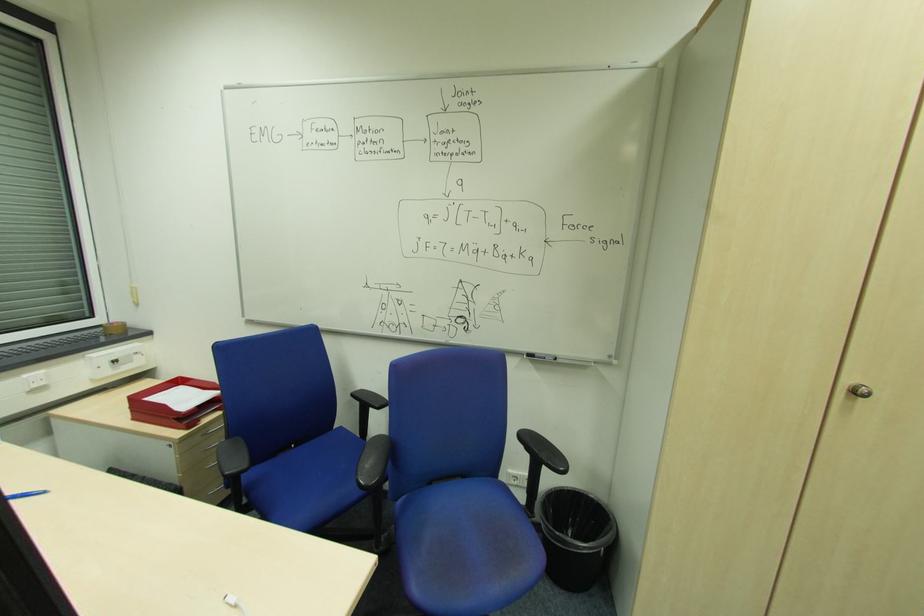
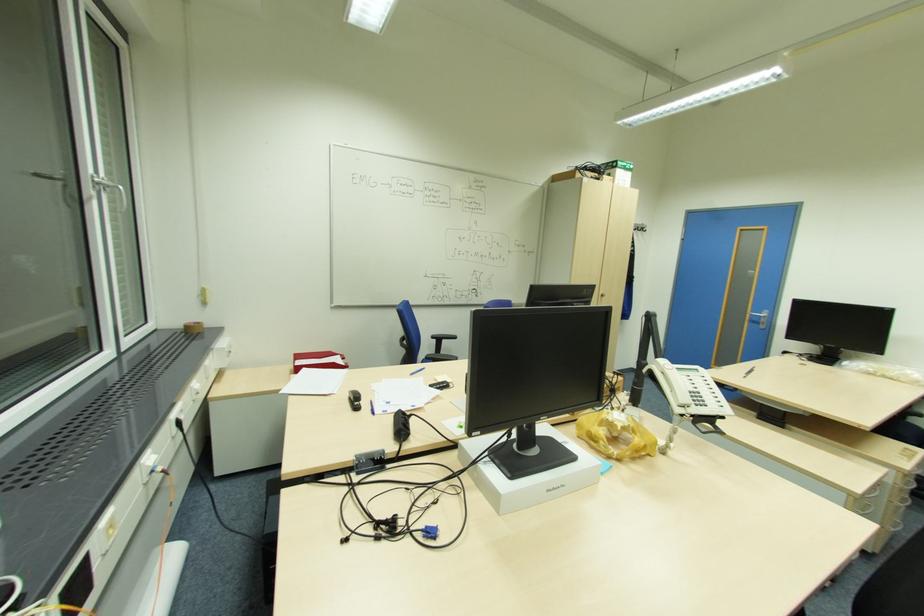
Find the pixel in the second image that matches [127,323] in the first image.

(201, 323)